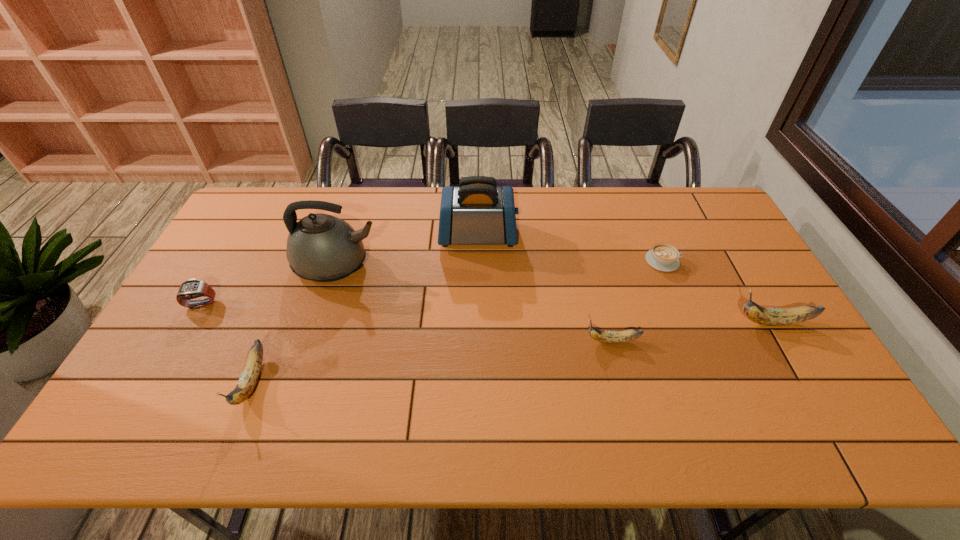
Image resolution: width=960 pixels, height=540 pixels. Find the location of `the shortest object`. the shortest object is located at coordinates (663, 257).

Find the location of a particular element. kettle is located at coordinates (320, 247).

Where is `vacant space located 0.330m at the stem of the second farthest banana`? vacant space located 0.330m at the stem of the second farthest banana is located at coordinates (462, 341).

Image resolution: width=960 pixels, height=540 pixels. Identify the location of free space located at the stem of the second farthest banana. (510, 341).

Locate an element on the screen. vacant area situated 0.200m at the stem of the second farthest banana is located at coordinates (510, 341).

At what (x,y) coordinates should I click in order to perform the action: click on vacant space situated 0.200m at the stem of the tallest banana. Please return your answer as a coordinate pair (x, y). Looking at the image, I should click on (661, 322).

The image size is (960, 540). I want to click on free space located at the stem of the tallest banana, so click(x=597, y=322).

Where is `vacant space located 0.110m at the stem of the tallest banana`? The width and height of the screenshot is (960, 540). vacant space located 0.110m at the stem of the tallest banana is located at coordinates (693, 322).

Identify the location of free location located on the front-facing side of the toaster. (629, 236).

Where is `vacant space located on the back of the leftmost object`? vacant space located on the back of the leftmost object is located at coordinates (234, 246).